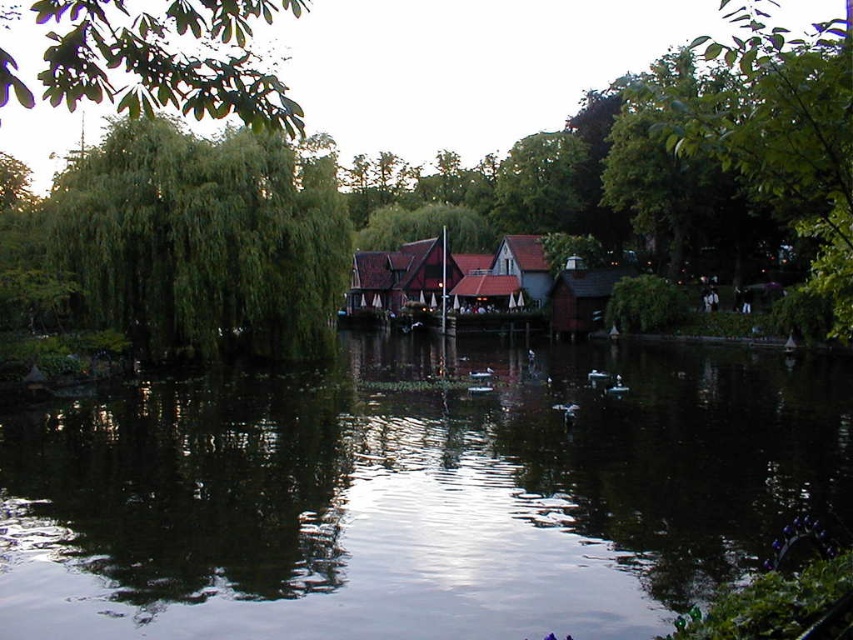
You are standing at the point with coordinates (581, 298) in the lakeside scene. What object is exactly at your current location?

The wooden hut at center is located at point (581, 298).